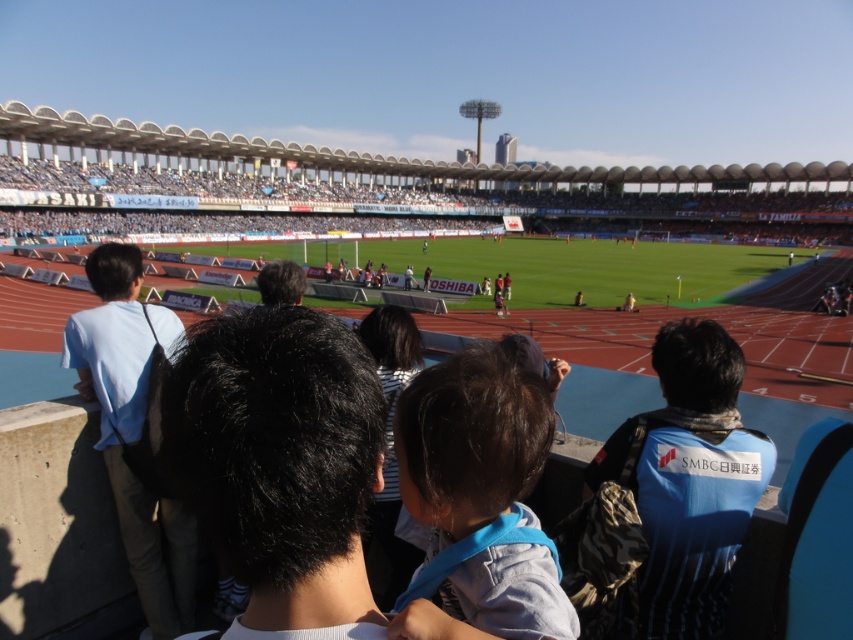
You are a photographer positioned at the center of the stadium. You want to capture a photo that includes both the blue fabric jacket at lower right and the light blue shirt at left. What is the minimum focal length lens you should use to ensure both subjects are in frame?

The minimum focal length lens required would depend on the camera sensor size and the desired framing. However, given the distance of 7.45 meters between the blue fabric jacket at lower right and the light blue shirt at left, a wide angle lens is recommended to capture both subjects in the same frame.

You are a photographer standing at the edge of the field. You want to take a photo that includes both the blue denim shirt at center and the light blue shirt at left. The minimum distance your camera can focus on two subjects is 5 meters. Will you be able to capture both in focus?

The blue denim shirt at center is 5.24 meters away from the light blue shirt at left. Since the distance between them is slightly over 5 meters, your camera might struggle to keep both in focus simultaneously. Consider moving closer to reduce the distance between the subjects in the frame.